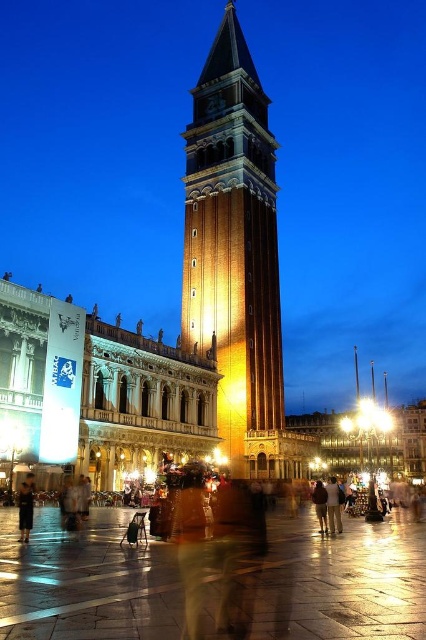
Is polished stone pavement at center to the right of brown leather jacket at center from the viewer's perspective?

Incorrect, polished stone pavement at center is not on the right side of brown leather jacket at center.

From the picture: Can you confirm if polished stone pavement at center is shorter than brown leather jacket at center?

Yes, polished stone pavement at center is shorter than brown leather jacket at center.

This screenshot has height=640, width=426. In order to click on polished stone pavement at center in this screenshot , I will do [337, 580].

Does golden stone bell tower at center have a smaller size compared to brown leather jacket at center?

No, golden stone bell tower at center is not smaller than brown leather jacket at center.

Is point (276, 330) more distant than point (333, 492)?

Yes, point (276, 330) is behind point (333, 492).

Where is `golden stone bell tower at center`? The width and height of the screenshot is (426, 640). golden stone bell tower at center is located at coordinates (233, 241).

Can you confirm if polished stone pavement at center is positioned below dark brown backpack at center?

Incorrect, polished stone pavement at center is not positioned below dark brown backpack at center.

Between polished stone pavement at center and dark brown backpack at center, which one is positioned lower?

dark brown backpack at center

This screenshot has width=426, height=640. Identify the location of polished stone pavement at center. (337, 580).

The image size is (426, 640). Identify the location of polished stone pavement at center. (337, 580).